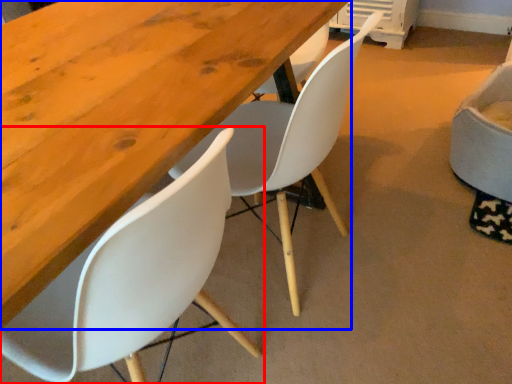
Question: Among these objects, which one is nearest to the camera, chair (highlighted by a red box) or table (highlighted by a blue box)?

Choices:
 (A) chair
 (B) table

Answer: (A)